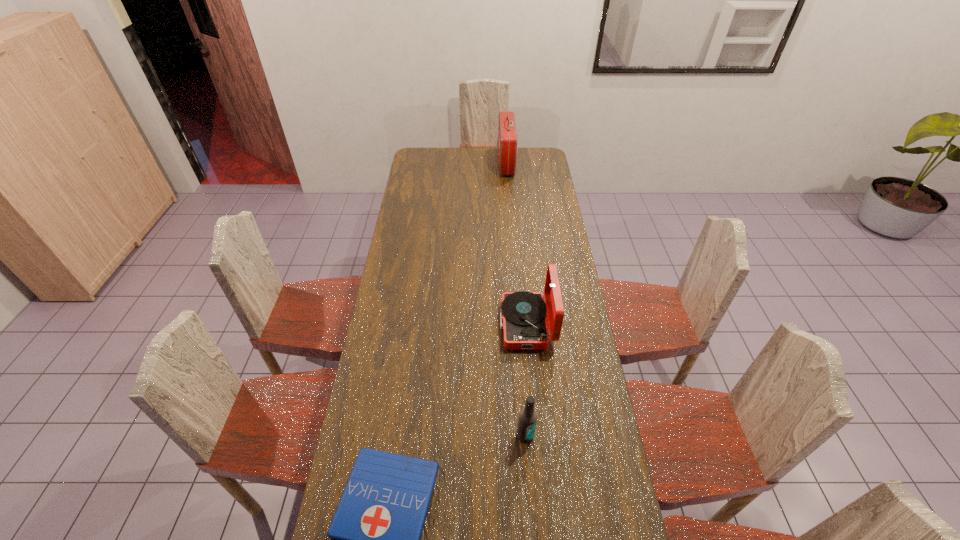
Where is `the tallest object`? This screenshot has width=960, height=540. the tallest object is located at coordinates (507, 136).

You are a GUI agent. You are given a task and a screenshot of the screen. Output one action in this format:
    pyautogui.click(x=<x>, y=<y>)
    Task: Click on the farthest object
    The image size is (960, 540).
    Given the screenshot: What is the action you would take?
    pyautogui.click(x=507, y=136)

Locate an element on the screen. This screenshot has width=960, height=540. the second farthest object is located at coordinates (525, 327).

Where is `the second nearest object`? The width and height of the screenshot is (960, 540). the second nearest object is located at coordinates (527, 421).

In order to click on vacant space located 0.330m on the side of the farthest object with the first aid cross symbol in this screenshot , I will do `click(441, 163)`.

I want to click on vacant space located 0.130m on the side of the farthest object with the first aid cross symbol, so click(476, 163).

Where is `blank space located 0.380m on the side of the farthest object with the first aid cross symbol`? Image resolution: width=960 pixels, height=540 pixels. blank space located 0.380m on the side of the farthest object with the first aid cross symbol is located at coordinates point(432,163).

Find the location of a particular element. free space located 0.050m on the front-facing side of the phonograph_record is located at coordinates (x=487, y=325).

Find the location of a particular element. free location located on the front-facing side of the phonograph_record is located at coordinates (453, 325).

You are a GUI agent. You are given a task and a screenshot of the screen. Output one action in this format:
    pyautogui.click(x=<x>, y=<y>)
    Task: Click on the free location located 0.060m on the front-facing side of the phonograph_record
    
    Given the screenshot: What is the action you would take?
    pyautogui.click(x=485, y=325)